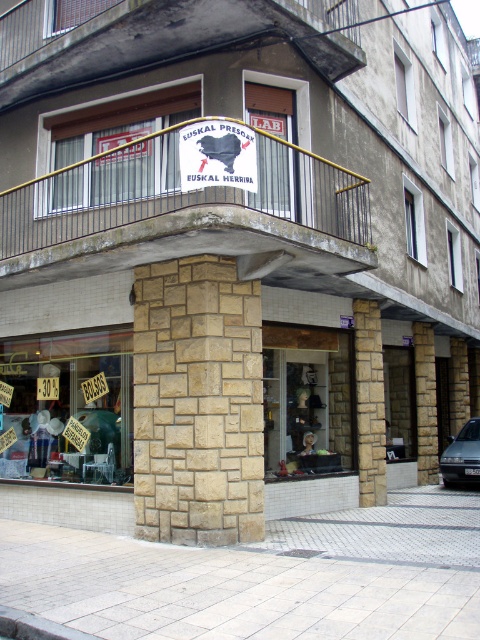
You are a delivery person standing in front of the storefront. You need to place a heavy box on the ground. Which surface should you choose between the white brick pavement at lower center and the stone at center to ensure it can support the weight?

The stone at center is a better choice because it is above the white brick pavement at lower center, making it more stable and likely able to support heavier loads.

What object is located at the coordinates point (68,406)?

The point (68,406) corresponds to the matte glass shop window at lower left.